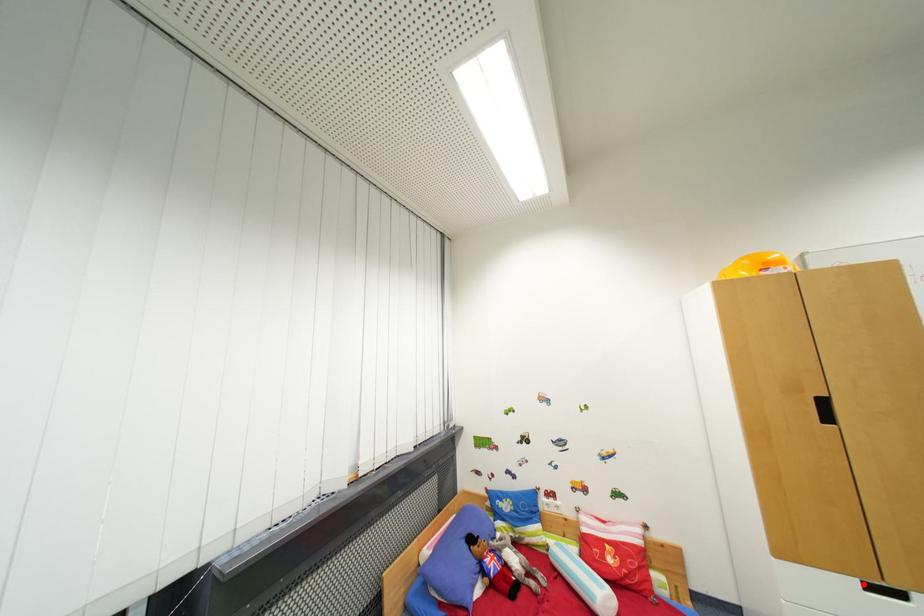
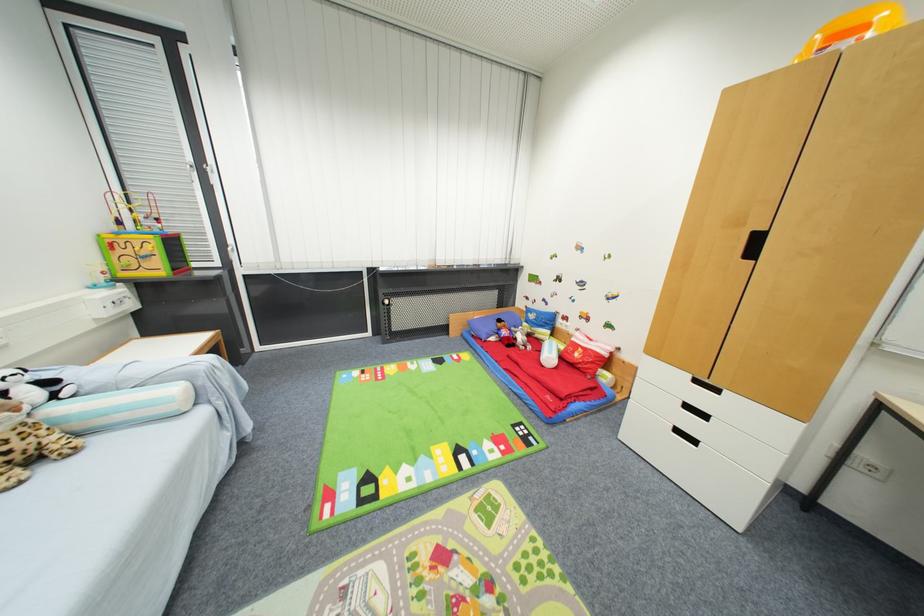
The point at the highlighted location is marked in the first image. Where is the corresponding point in the second image?

(695, 378)